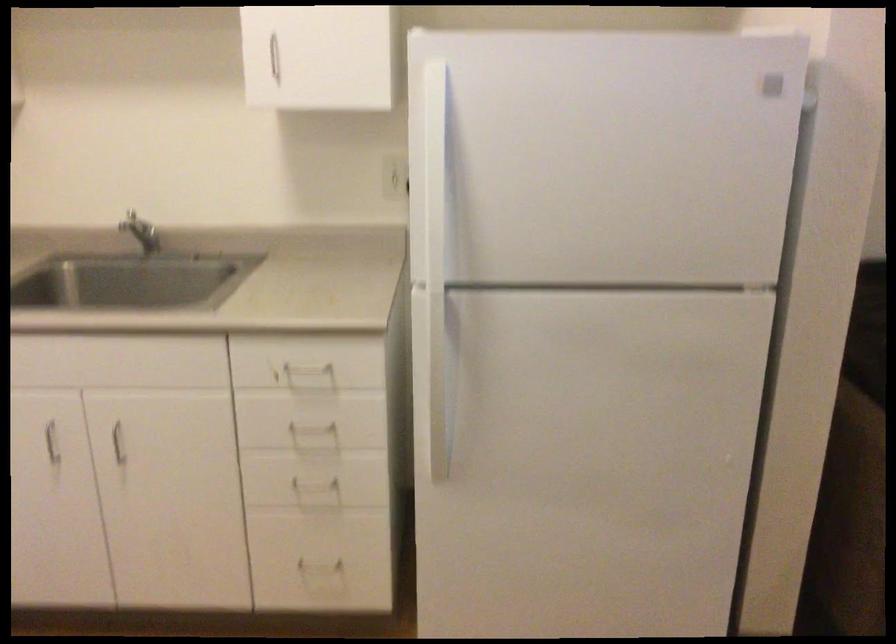
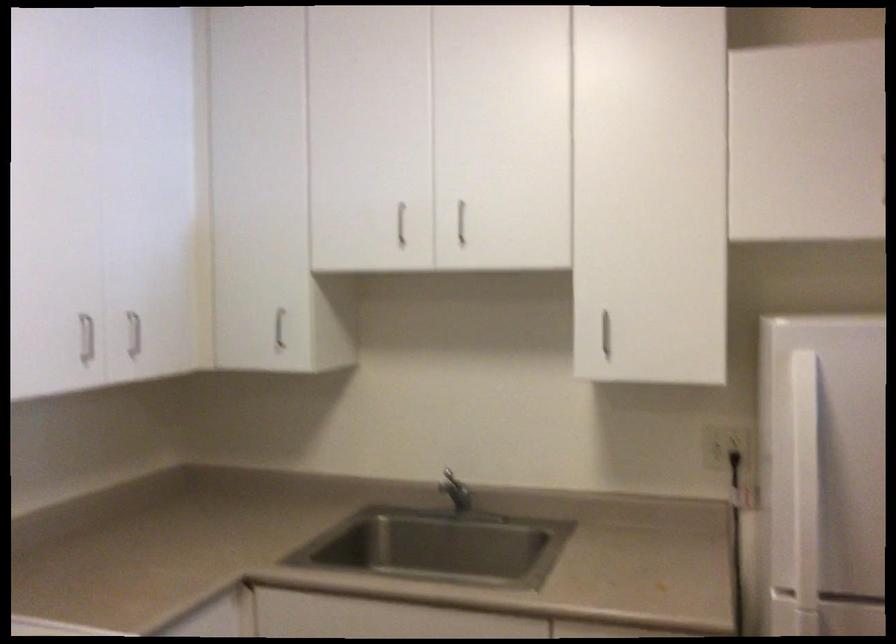
Question: The camera is either moving clockwise (left) or counter-clockwise (right) around the object. The first image is from the beginning of the video and the second image is from the end. Is the camera moving left or right when shooting the video?

Choices:
 (A) Left
 (B) Right

Answer: (B)